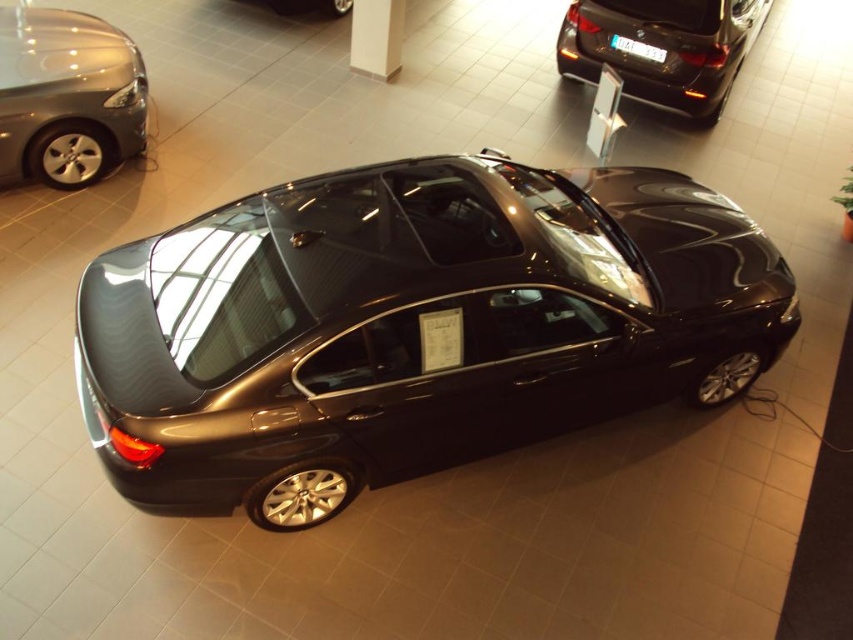
You are a delivery person who needs to move a 10 feet long crate into the showroom. The crate must be placed between the glossy black car at upper right and the glossy metallic car at upper center. Is there enough space between them to fit the crate?

The glossy black car at upper right is 13.04 feet from the glossy metallic car at upper center, so yes, the 10 feet long crate can fit between them since the distance is greater than the crate length.

You are a customer in the showroom and want to park your compact car between the glossy black car at upper right and the glossy metallic car at upper center. Can you fit your car in the available space between them?

The glossy black car at upper right is wider than the glossy metallic car at upper center. Therefore, the space between them may be sufficient for your compact car, but it depends on the exact dimensions of the space and your car. However, since the glossy black car at upper right is wider, the total available space might be narrower than if both cars were of similar width. Without specific measurements, it is difficult to confirm.